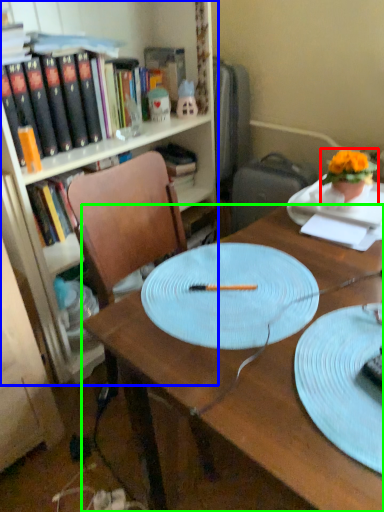
Question: Which object is positioned closest to houseplant (highlighted by a red box)? Select from bookcase (highlighted by a blue box) and desk (highlighted by a green box).

Choices:
 (A) bookcase
 (B) desk

Answer: (B)